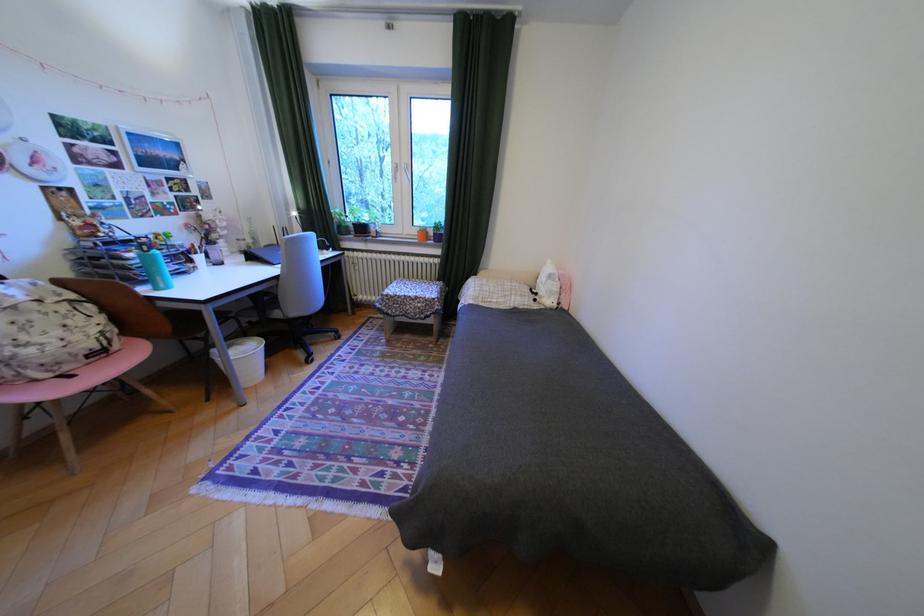
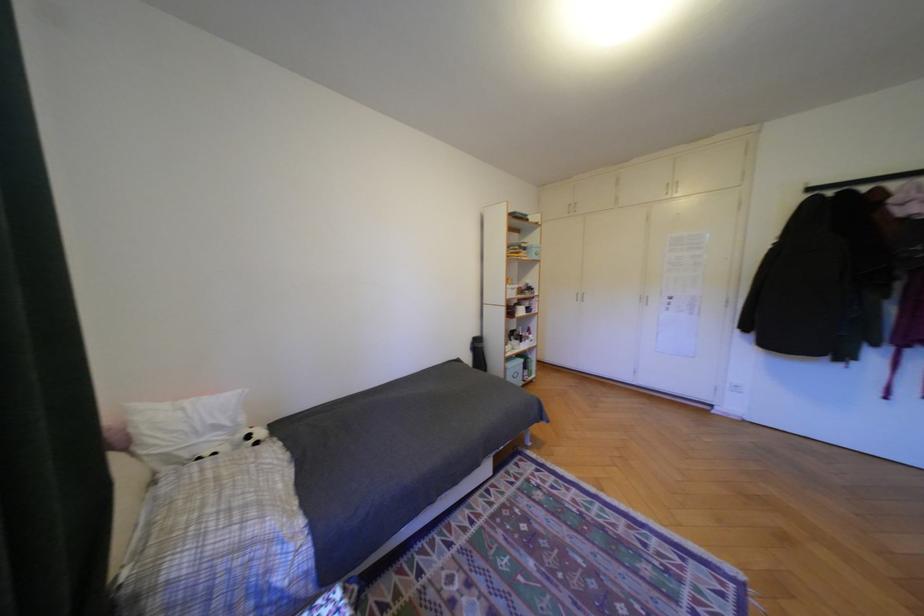
Find the pixel in the second image that matches the point at 548,294 in the first image.

(261, 437)